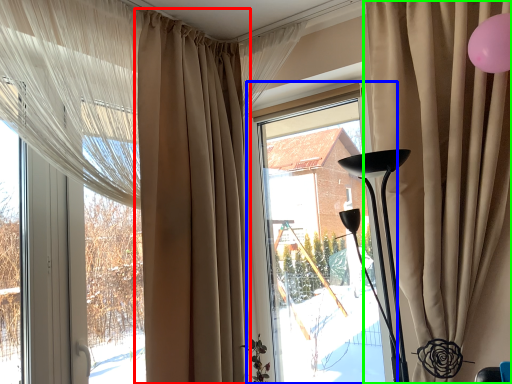
Question: Based on their relative distances, which object is farther from curtain (highlighted by a red box)? Choose from window (highlighted by a blue box) and curtain (highlighted by a green box).

Choices:
 (A) window
 (B) curtain

Answer: (B)